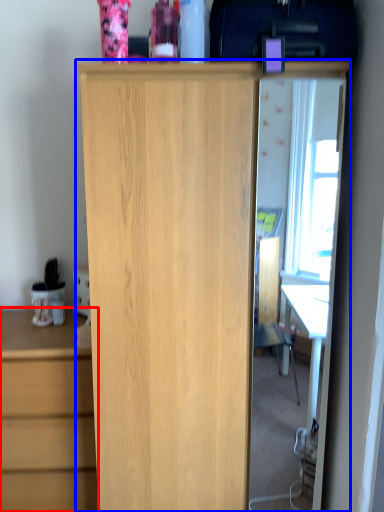
Question: Which object is further to the camera taking this photo, chest of drawers (highlighted by a red box) or cupboard (highlighted by a blue box)?

Choices:
 (A) chest of drawers
 (B) cupboard

Answer: (A)